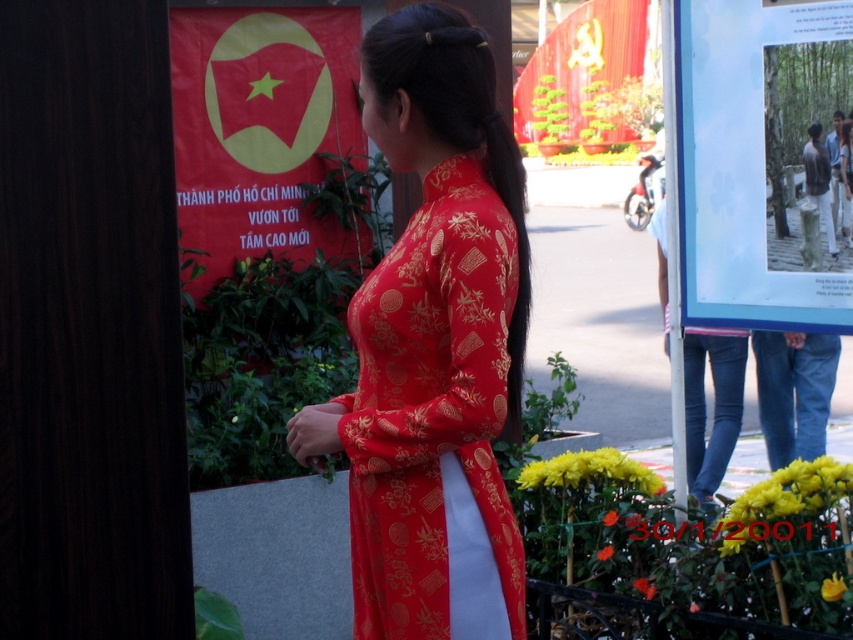
Which is in front, point (508, 520) or point (759, 280)?

Point (508, 520) is more forward.

Describe the element at coordinates (430, 406) in the screenshot. The width and height of the screenshot is (853, 640). I see `shiny brocade ao dai at center` at that location.

This screenshot has width=853, height=640. What are the coordinates of `shiny brocade ao dai at center` in the screenshot? It's located at (430, 406).

Who is more distant from viewer, [178,97] or [815,288]?

The point [178,97] is behind.

Consider the image. Who is positioned more to the left, red matte poster at upper left or wooden signboard at upper right?

red matte poster at upper left

Which is behind, point (254, 60) or point (756, 6)?

Point (254, 60)

The image size is (853, 640). What are the coordinates of `red matte poster at upper left` in the screenshot? It's located at (258, 131).

Who is higher up, wooden signboard at upper right or jeans at lower right?

wooden signboard at upper right is above.

Is wooden signboard at upper right thinner than jeans at lower right?

No, wooden signboard at upper right is not thinner than jeans at lower right.

Which is behind, point (821, 323) or point (709, 490)?

Point (709, 490)

You are a GUI agent. You are given a task and a screenshot of the screen. Output one action in this format:
    pyautogui.click(x=<x>, y=<y>)
    Task: Click on the wooden signboard at upper right
    
    Given the screenshot: What is the action you would take?
    pyautogui.click(x=741, y=166)